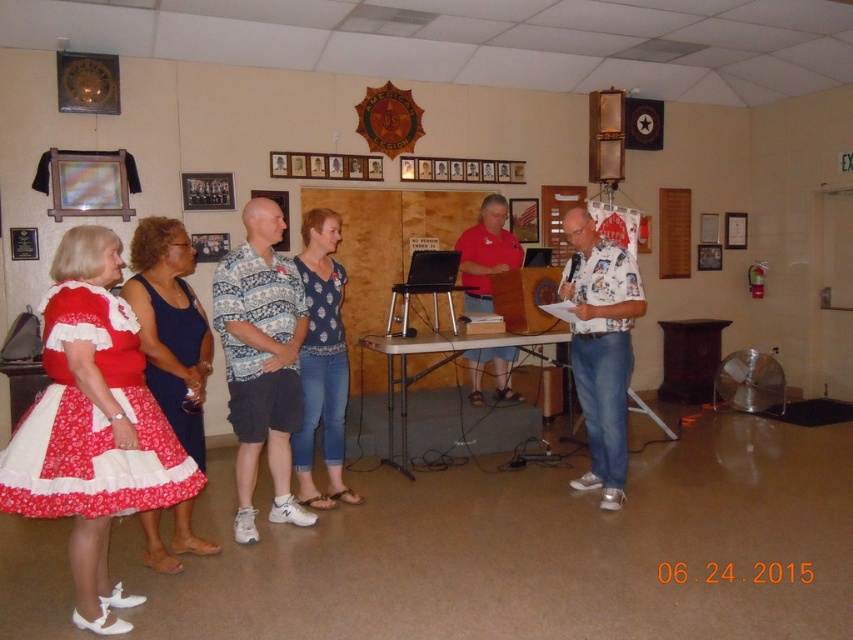
You are a photographer at the event and need to ensure all participants are visible in the group photo. The red floral fabric dress at lower left and the white printed shirt at center are partially hidden by the podium. Which one is more likely to be fully visible in the photo?

The red floral fabric dress at lower left is shorter than the white printed shirt at center, so the white printed shirt at center is more likely to be fully visible in the photo since it is taller and less likely to be obscured by the podium.

You are organizing a charity event and need to arrange seating for attendees. The red floral fabric dress at lower left and the blue printed blouse at center are part of the seating arrangement. Which attendee should you seat in a smaller chair to accommodate their clothing size?

The red floral fabric dress at lower left has a smaller size compared to the blue printed blouse at center, so the attendee wearing the red floral fabric dress at lower left should be seated in a smaller chair.

Based on the photo, you are standing at the back of the room and want to see the speaker at the podium clearly. Which object, the red floral fabric dress at lower left or the white printed shirt at center, is blocking your view more?

The red floral fabric dress at lower left is blocking your view more because it is in front of the white printed shirt at center.